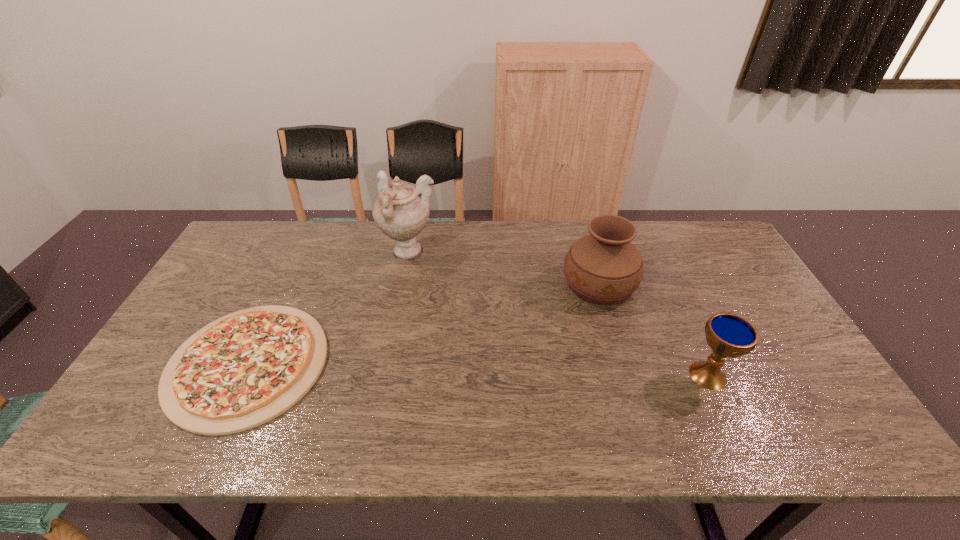
Find the location of a particular element. The height and width of the screenshot is (540, 960). vacant region at the near right corner is located at coordinates (811, 415).

The image size is (960, 540). Identify the location of vacant area that lies between the third shortest object and the chalice. (654, 329).

This screenshot has width=960, height=540. What are the coordinates of `blank region between the third object from right to left and the rightmost object` in the screenshot? It's located at (559, 314).

Identify the location of empty location between the chalice and the leftmost object. (478, 369).

The height and width of the screenshot is (540, 960). In order to click on free space between the second object from right to left and the rightmost object in this screenshot , I will do `click(654, 329)`.

Identify the location of free space between the chalice and the taller urn. (559, 314).

You are a GUI agent. You are given a task and a screenshot of the screen. Output one action in this format:
    pyautogui.click(x=<x>, y=<y>)
    Task: Click on the free space between the shortest object and the left urn
    This screenshot has width=960, height=540.
    Given the screenshot: What is the action you would take?
    pyautogui.click(x=328, y=308)

Where is `free area in between the leftmost object and the third object from right to left`? free area in between the leftmost object and the third object from right to left is located at coordinates (328, 308).

Identify the location of vacant space that's between the chalice and the right urn. (654, 329).

Find the location of a particular element. Image resolution: width=960 pixels, height=540 pixels. unoccupied area between the third shortest object and the left urn is located at coordinates (504, 268).